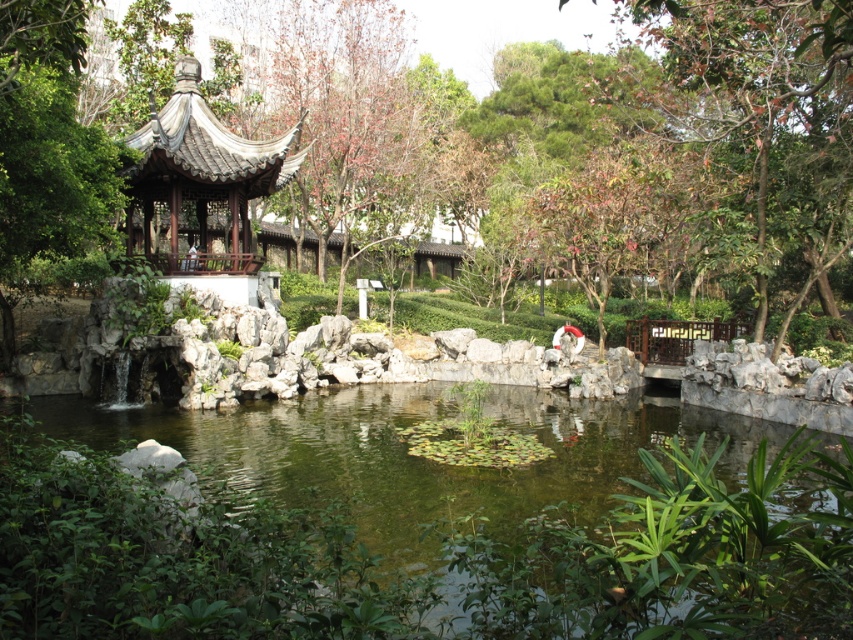
Question: Can you confirm if green leafy pond at center is wider than brown wood tree at upper right?

Choices:
 (A) no
 (B) yes

Answer: (B)

Question: Which of the following is the closest to the observer?

Choices:
 (A) (543, 54)
 (B) (764, 579)
 (C) (381, 40)

Answer: (B)

Question: Is green leafy pond at center further to camera compared to matte gray gazebo at center-left?

Choices:
 (A) no
 (B) yes

Answer: (A)

Question: Which is nearer to the brown wood tree at upper right?

Choices:
 (A) brown wood tree at upper center
 (B) green leafy pond at center
 (C) green leafy tree at center
 (D) matte gray gazebo at center-left

Answer: (C)

Question: Which point is closer to the camera?

Choices:
 (A) (622, 538)
 (B) (722, 134)
 (C) (364, 32)

Answer: (A)

Question: Is green leafy tree at center in front of brown wood tree at upper center?

Choices:
 (A) no
 (B) yes

Answer: (B)